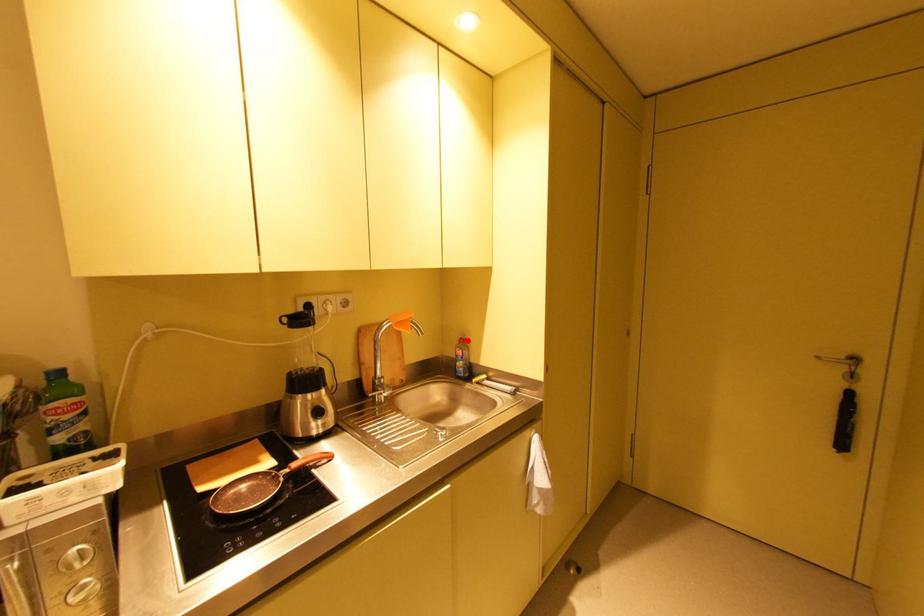
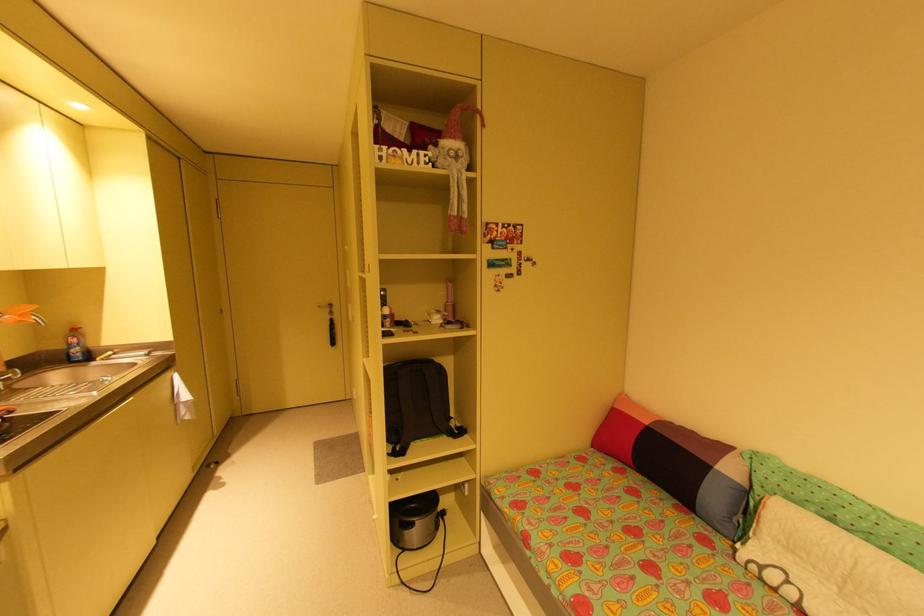
Where in the second image is the point corresponding to the highlighted location from the first image?

(79, 331)